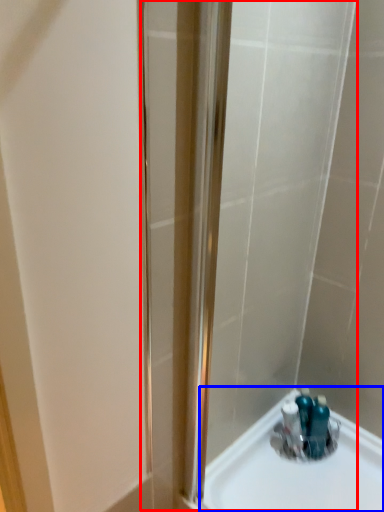
Question: Which of the following is the closest to the observer, shower door (highlighted by a red box) or sink (highlighted by a blue box)?

Choices:
 (A) shower door
 (B) sink

Answer: (A)